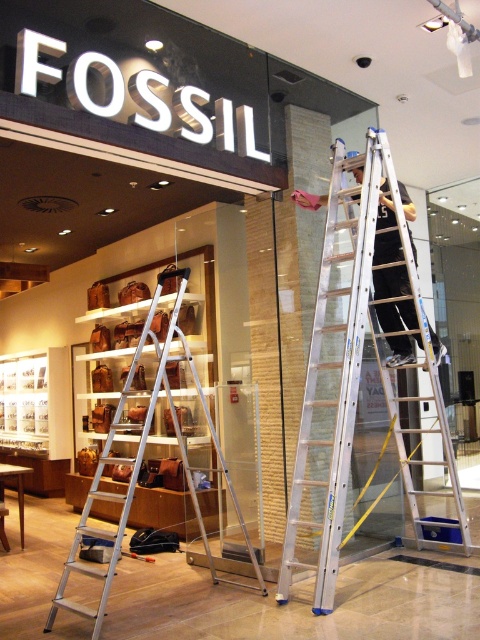
You are a customer entering the Fossil store and see the silver metallic ladder at center and the dark gray fabric pants at center. Which object is taller?

The silver metallic ladder at center is much taller than the dark gray fabric pants at center.

You are a delivery person who needs to place a large package on the highest shelf inside the Fossil store. The highest shelf is 2.5 meters tall. You see the silver metallic ladder at upper right and the silver metallic ladder at center. Which ladder should you use to reach the shelf?

The silver metallic ladder at upper right is much taller than the silver metallic ladder at center, so you should use the silver metallic ladder at upper right to reach the highest shelf that is 2.5 meters tall.